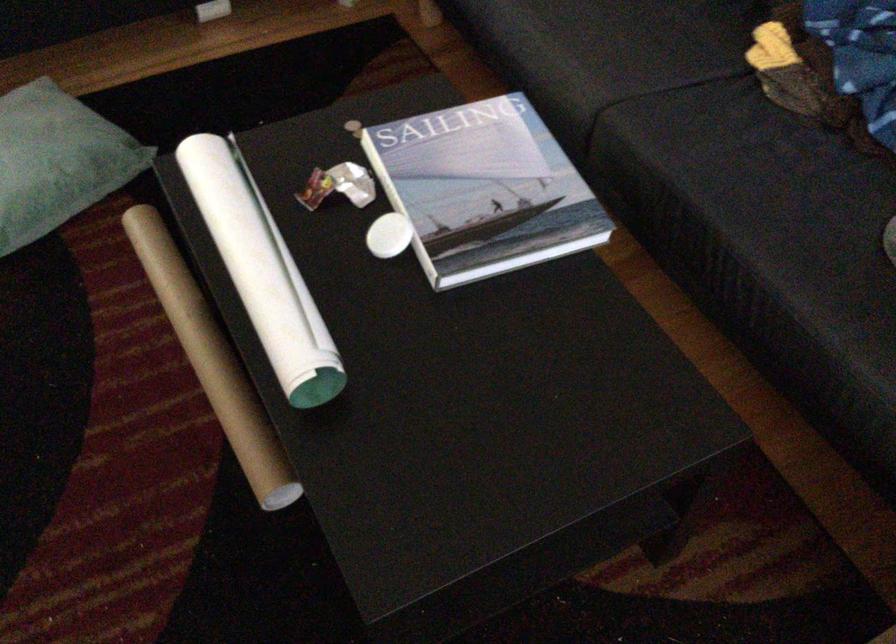
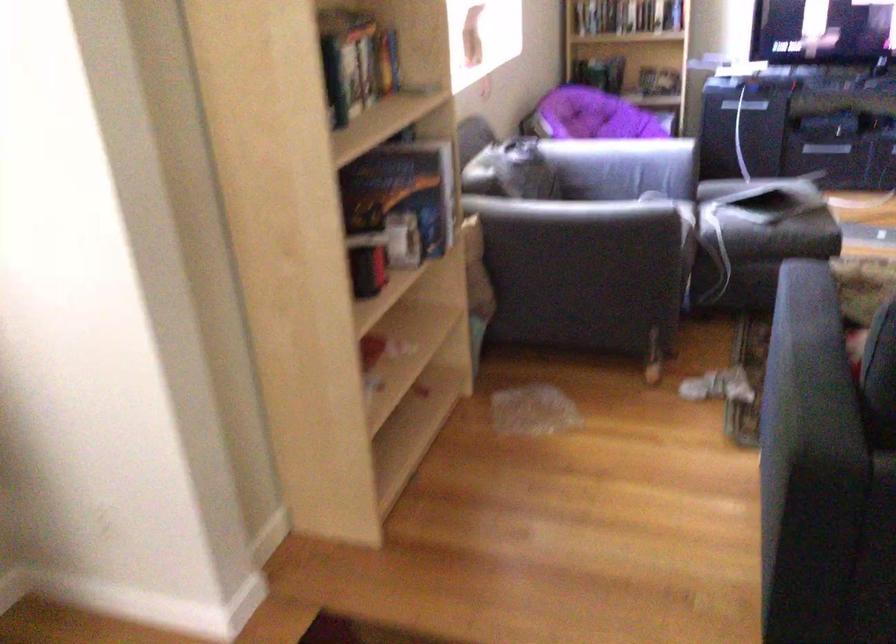
Question: The camera is either moving clockwise (left) or counter-clockwise (right) around the object. The first image is from the beginning of the video and the second image is from the end. Is the camera moving left or right when shooting the video?

Choices:
 (A) Left
 (B) Right

Answer: (B)